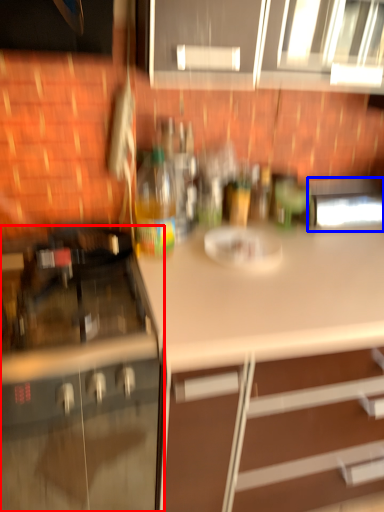
Question: Which object appears closest to the camera in this image, cabinetry (highlighted by a red box) or appliance (highlighted by a blue box)?

Choices:
 (A) cabinetry
 (B) appliance

Answer: (A)